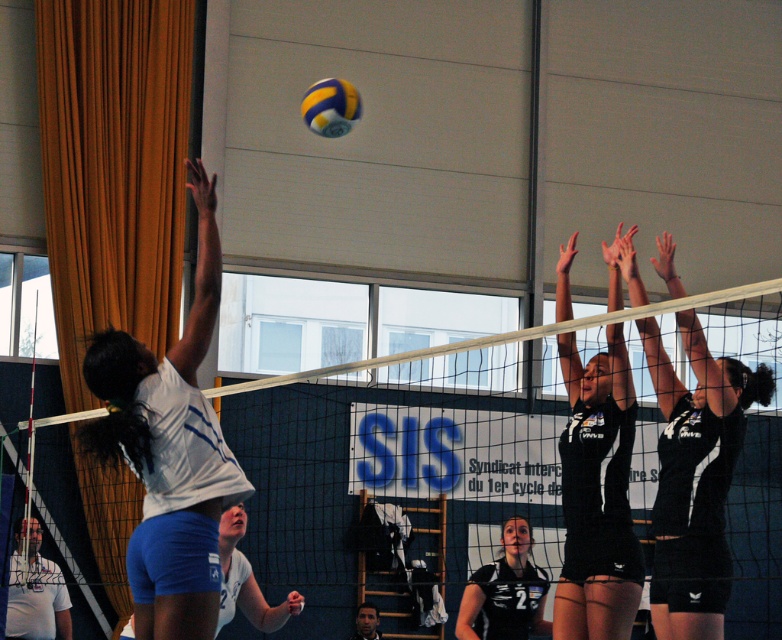
You are standing at the edge of the volleyball court and want to throw a ball to the player wearing the black matte uniform at center. If you can throw the ball up to 7 meters, will you be able to reach them?

The black matte uniform at center and viewer are 6.53 meters apart from each other. Since your throwing range is up to 7 meters, you can successfully reach them by throwing the ball the required distance.